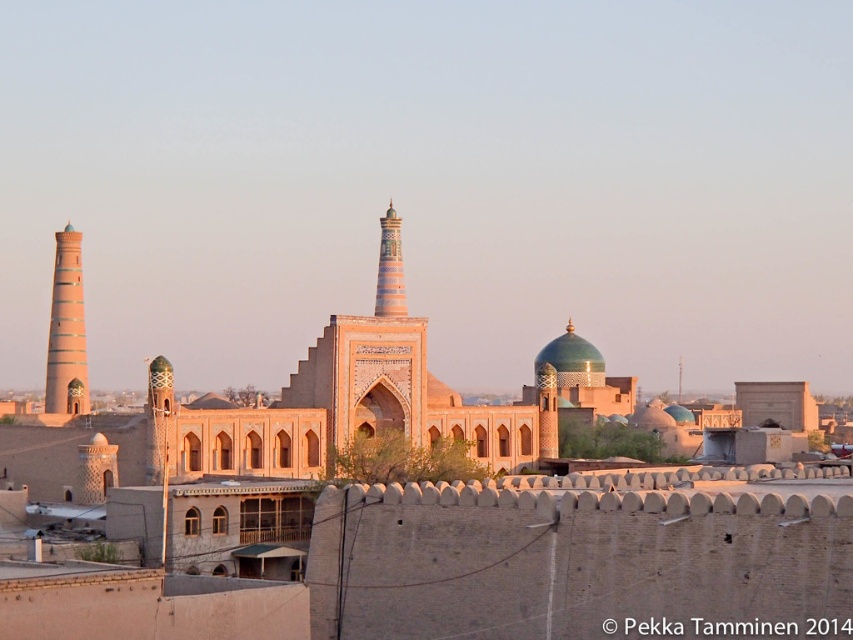
Where is `light brown clay tower at left`? This screenshot has height=640, width=853. light brown clay tower at left is located at coordinates (67, 330).

Based on the photo, who is positioned more to the right, light brown clay tower at left or multicolored ceramic minaret at center?

multicolored ceramic minaret at center is more to the right.

This screenshot has height=640, width=853. What are the coordinates of `light brown clay tower at left` in the screenshot? It's located at (67, 330).